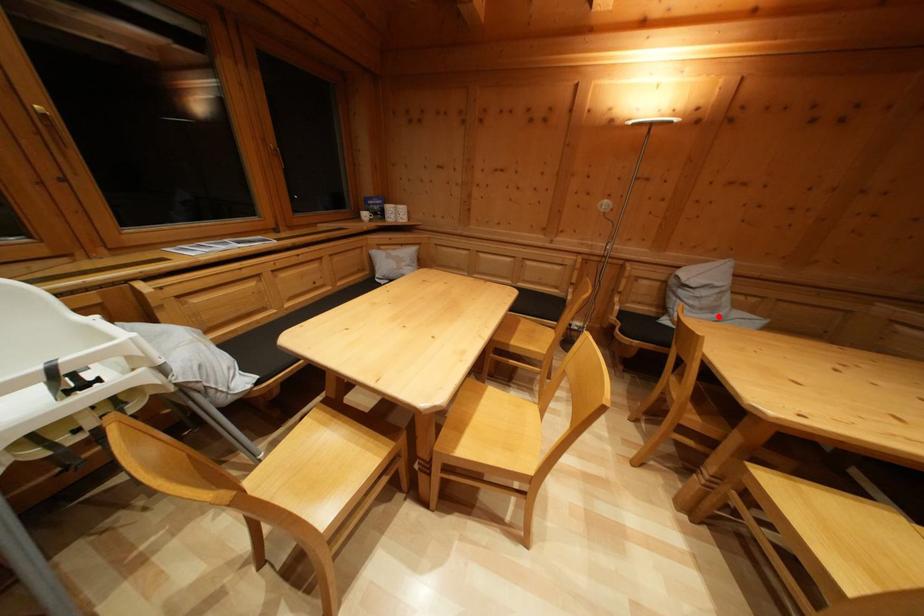
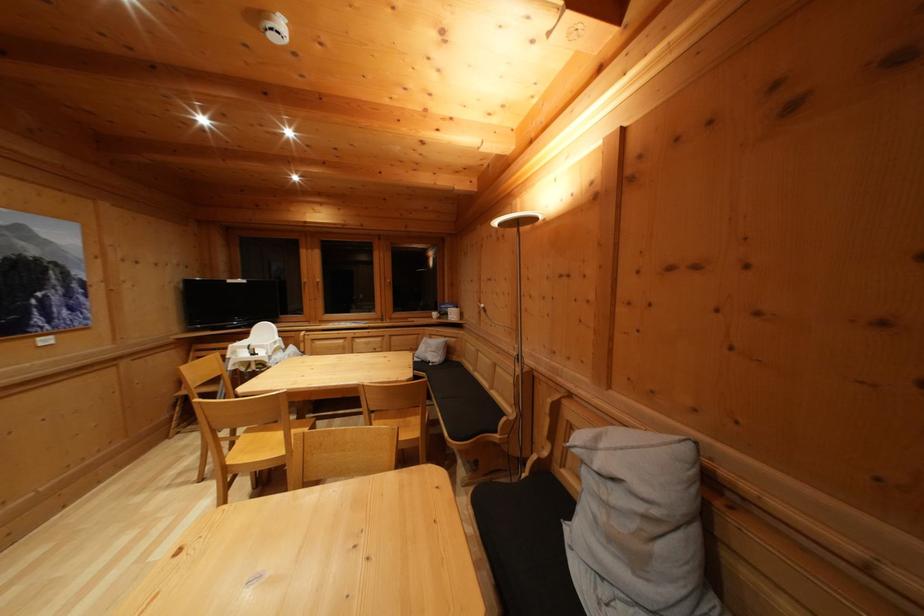
In the second image, find the point that corresponds to the highlighted location in the first image.

(640, 565)